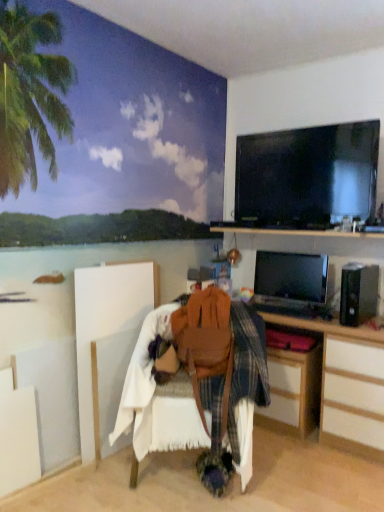
Find the location of a particular element. The width and height of the screenshot is (384, 512). vacant space to the right of leather at center is located at coordinates (297, 468).